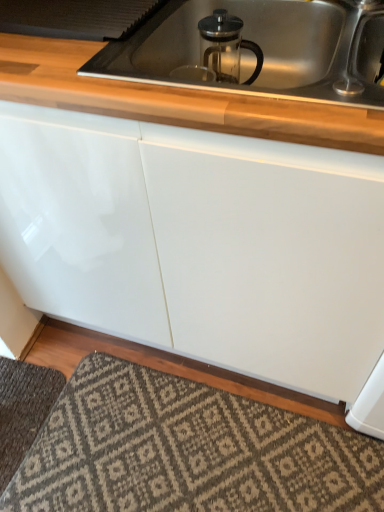
Question: Considering the relative positions of patterned carpet at lower center, which appears as the 2th doormat when viewed from the left, and clear glass french press at upper center in the image provided, is patterned carpet at lower center, which appears as the 2th doormat when viewed from the left, to the right of clear glass french press at upper center from the viewer's perspective?

Choices:
 (A) yes
 (B) no

Answer: (B)

Question: Are patterned carpet at lower center, which appears as the 2th doormat when viewed from the left, and clear glass french press at upper center beside each other?

Choices:
 (A) no
 (B) yes

Answer: (A)

Question: Can you confirm if patterned carpet at lower center, placed as the 1th doormat when sorted from right to left, is taller than clear glass french press at upper center?

Choices:
 (A) no
 (B) yes

Answer: (A)

Question: Considering the relative sizes of patterned carpet at lower center, which appears as the 2th doormat when viewed from the left, and clear glass french press at upper center in the image provided, is patterned carpet at lower center, which appears as the 2th doormat when viewed from the left, wider than clear glass french press at upper center?

Choices:
 (A) yes
 (B) no

Answer: (A)

Question: From the image's perspective, would you say patterned carpet at lower center, which appears as the 2th doormat when viewed from the left, is positioned over clear glass french press at upper center?

Choices:
 (A) yes
 (B) no

Answer: (B)

Question: From a real-world perspective, is patterned carpet at lower center, which appears as the 2th doormat when viewed from the left, located higher than clear glass french press at upper center?

Choices:
 (A) no
 (B) yes

Answer: (A)

Question: Could you tell me if clear glass french press at upper center is turned towards satin nickel faucet at upper right?

Choices:
 (A) no
 (B) yes

Answer: (A)

Question: Considering the relative sizes of clear glass french press at upper center and satin nickel faucet at upper right in the image provided, is clear glass french press at upper center taller than satin nickel faucet at upper right?

Choices:
 (A) no
 (B) yes

Answer: (B)

Question: Is clear glass french press at upper center surrounding satin nickel faucet at upper right?

Choices:
 (A) no
 (B) yes

Answer: (A)

Question: Can you confirm if clear glass french press at upper center is positioned to the right of satin nickel faucet at upper right?

Choices:
 (A) yes
 (B) no

Answer: (B)

Question: From a real-world perspective, is clear glass french press at upper center physically below satin nickel faucet at upper right?

Choices:
 (A) no
 (B) yes

Answer: (B)

Question: Does clear glass french press at upper center come behind satin nickel faucet at upper right?

Choices:
 (A) no
 (B) yes

Answer: (B)

Question: Does satin nickel faucet at upper right have a lesser width compared to dark gray textured rug at lower left, which appears as the 1th doormat when viewed from the left?

Choices:
 (A) yes
 (B) no

Answer: (A)